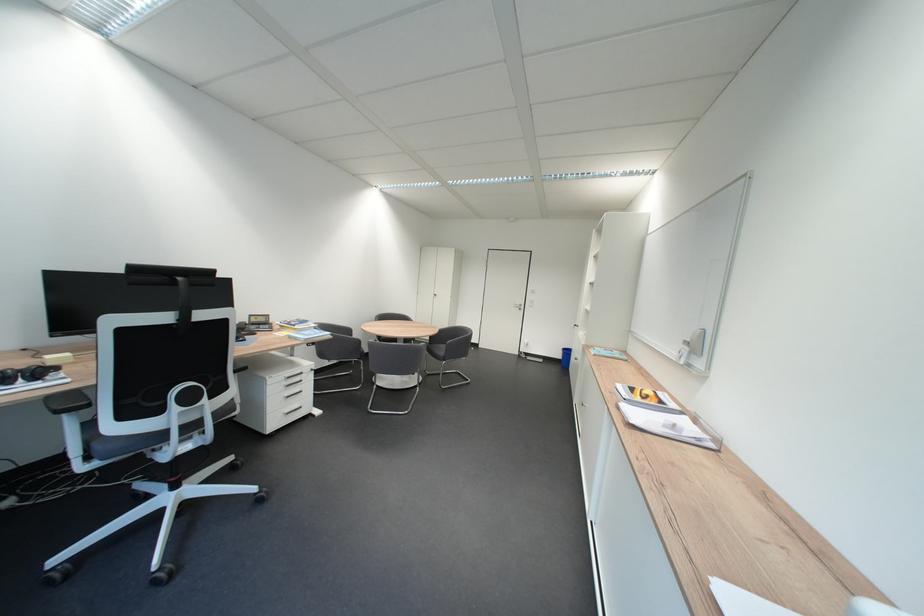
Find where to lift the clear paper tray. Please return your answer as a coordinate pair (x, y).

(665, 424)